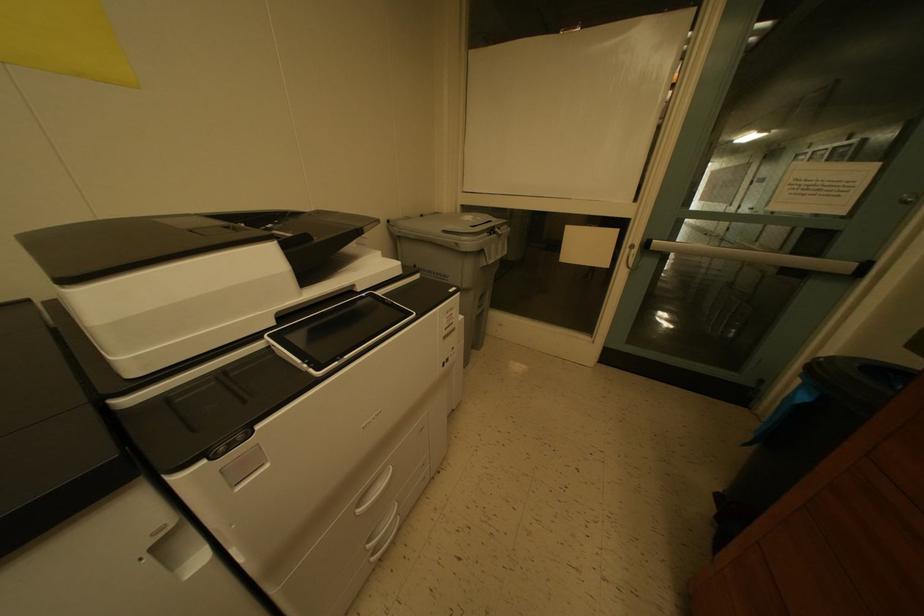
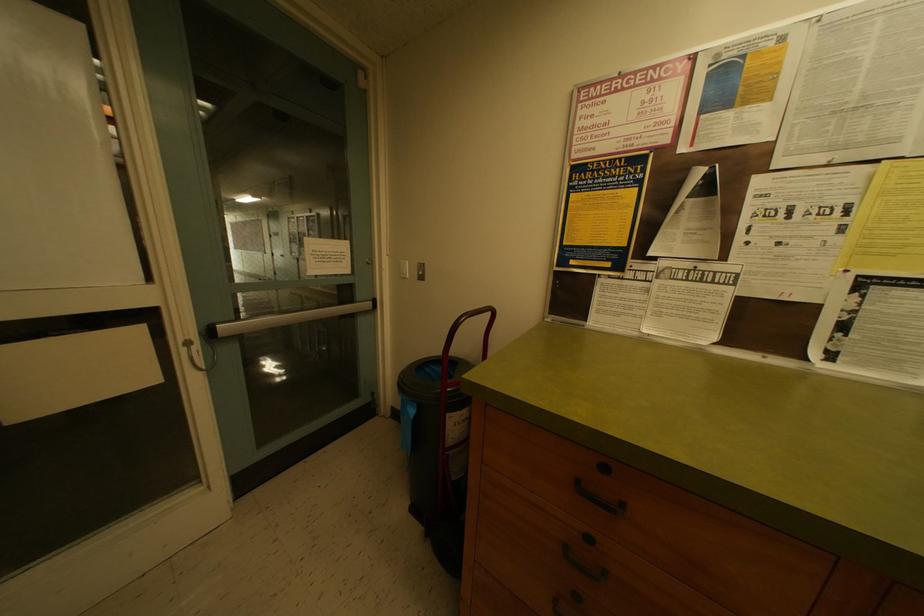
Question: The camera is either moving clockwise (left) or counter-clockwise (right) around the object. The first image is from the beginning of the video and the second image is from the end. Is the camera moving left or right when shooting the video?

Choices:
 (A) Left
 (B) Right

Answer: (A)